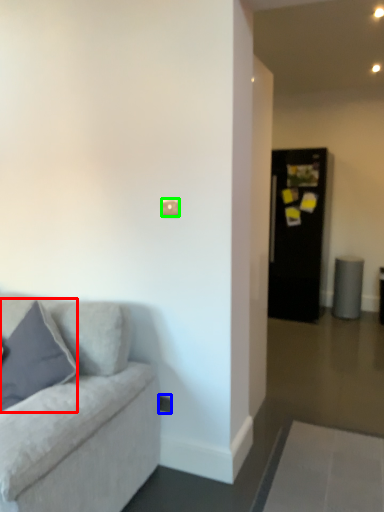
Question: Which is farther away from pillow (highlighted by a red box)? electric outlet (highlighted by a blue box) or light switch (highlighted by a green box)?

Choices:
 (A) electric outlet
 (B) light switch

Answer: (B)